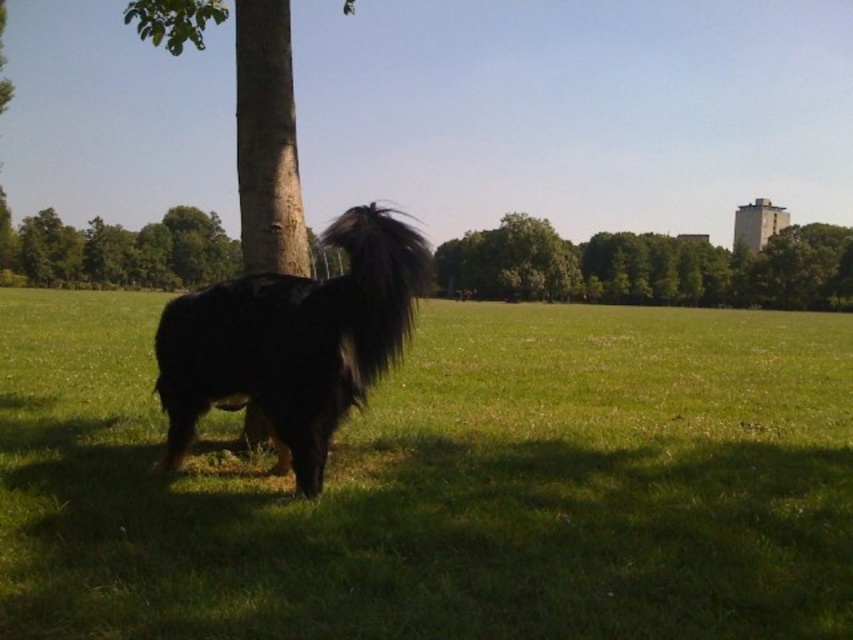
You are a photographer trying to capture the black fur dog at center and the green leafy tree at upper center in the same frame. Based on their positions, which object is closer to the camera?

The black fur dog at center is closer to the camera than the green leafy tree at upper center because it is positioned below it in the image.

You are standing in the middle of the grassy field and want to reach the two points marked in the image. Which point, point [496,593] or point [54,275], is closer to you?

Point [496,593] is closer to the viewer than point [54,275].

You are a photographer trying to capture the black fur dog at center and the green leafy tree at upper left in the same frame. Based on their sizes in the image, which one appears larger?

The black fur dog at center appears larger than the green leafy tree at upper left because it is closer to the camera, even though the tree is taller in reality.